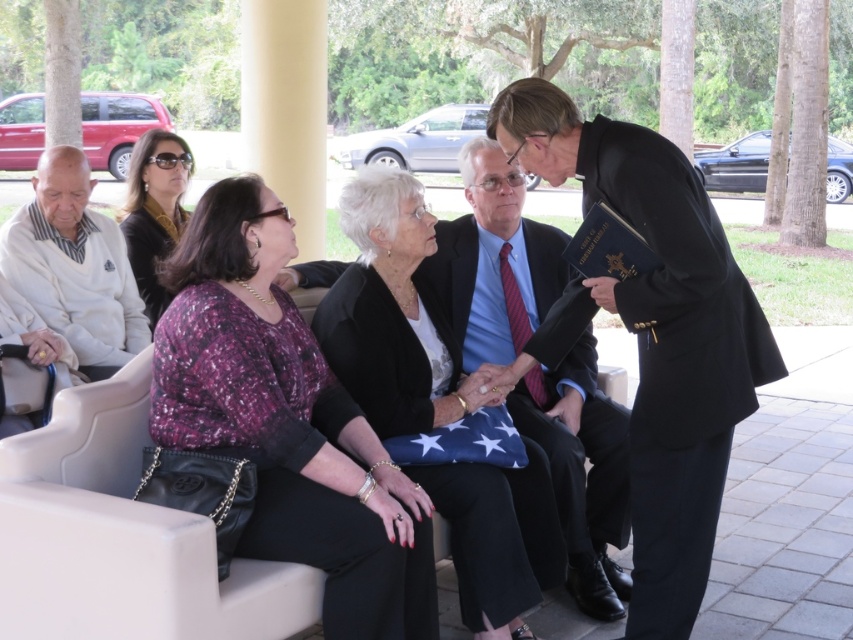
Question: Among these objects, which one is nearest to the camera?

Choices:
 (A) black suit at right
 (B) black satin blazer at center
 (C) white sweater at left

Answer: (A)

Question: Which point is closer to the camera?

Choices:
 (A) black suit at center
 (B) matte purple blouse at center
 (C) satin black dress at upper left

Answer: (B)

Question: Does matte purple blouse at center appear under satin black dress at upper left?

Choices:
 (A) no
 (B) yes

Answer: (B)

Question: Does matte purple blouse at center have a greater width compared to black suit at right?

Choices:
 (A) no
 (B) yes

Answer: (A)

Question: From the image, what is the correct spatial relationship of black suit at right in relation to black suit at center?

Choices:
 (A) left
 (B) right

Answer: (B)

Question: Which is farther from the black satin blazer at center?

Choices:
 (A) black suit at center
 (B) black suit at right

Answer: (B)